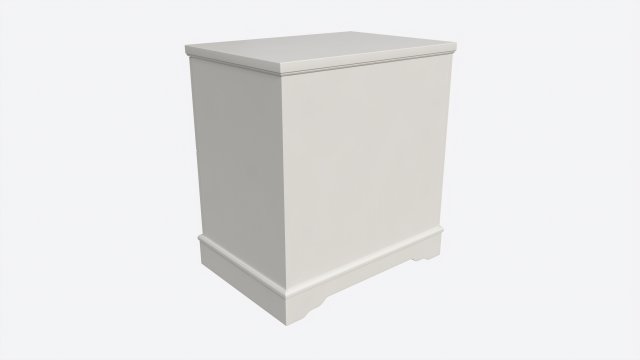
Identify the location of to the right of furniture. (498, 146).